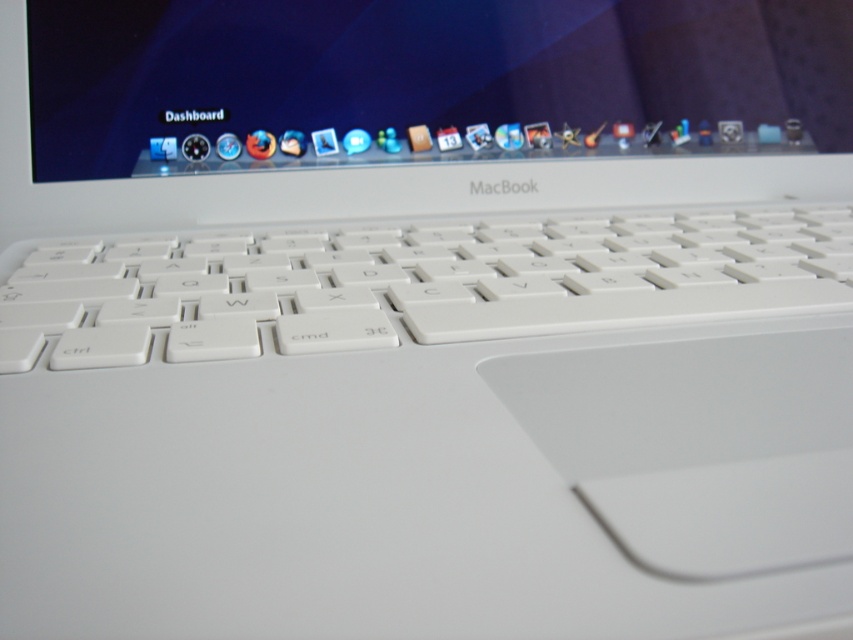
You are a delivery robot that needs to place a package on the glossy plastic computer screen at upper center. The package is 26 inches long. Can you fit the package on the screen without overlapping the edges?

The glossy plastic computer screen at upper center and camera are 25.92 inches apart. Since the package is 26 inches long, it is slightly longer than the available space between them, so it won mentioned in the description. The answer should be based on the distance between the screen and the camera. The package is 26 inches long, and the distance between the screen and camera is 25.92 inches. Therefore, the package cannot fit without overlapping the edges.

You are a delivery robot with a 20 cm wide package. You need to place the package between the glossy plastic computer screen at upper center and the white plastic keyboard at center. Can you fit the package in that space?

The distance between the glossy plastic computer screen at upper center and the white plastic keyboard at center is 22.14 centimeters. Since the package is 20 cm wide, it can fit in the space between them.

You are trying to reach the glossy plastic computer screen at upper center while your hand is currently on the white plastic keyboard at center. Which object will you move your hand away from first?

Since the glossy plastic computer screen at upper center is closer to you than the white plastic keyboard at center, you would need to move your hand away from the white plastic keyboard at center first to reach the screen.